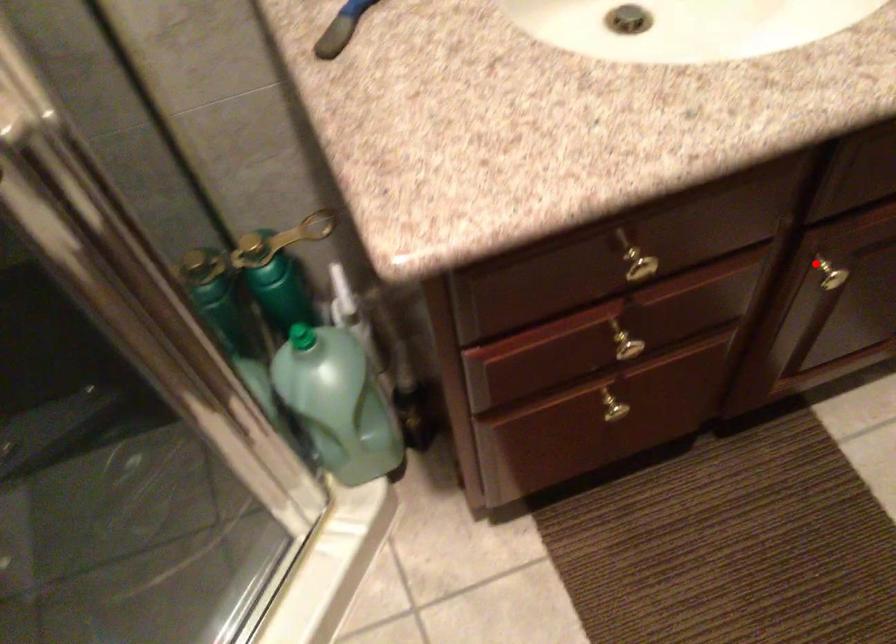
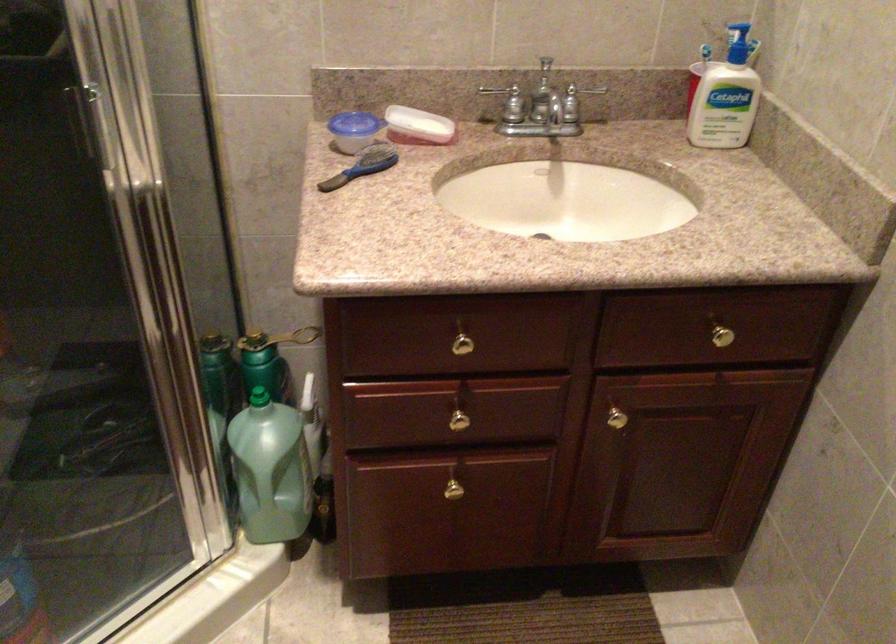
Question: I am providing you with two images of the same scene from different viewpoints. Given a red point in image1, look at the same physical point in image2. Is it:

Choices:
 (A) Closer to the viewpoint
 (B) Farther from the viewpoint

Answer: (B)